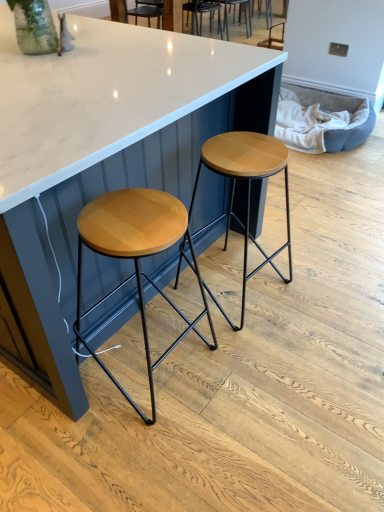
The height and width of the screenshot is (512, 384). Identify the location of vacant space in front of woodenmaterial/texturestool at left, which appears as the 2th stool when viewed from the right. (140, 448).